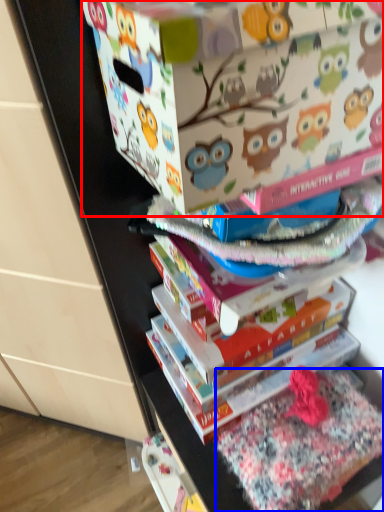
Question: Which object is closer to the camera taking this photo, cardboard box (highlighted by a red box) or fabric (highlighted by a blue box)?

Choices:
 (A) cardboard box
 (B) fabric

Answer: (A)